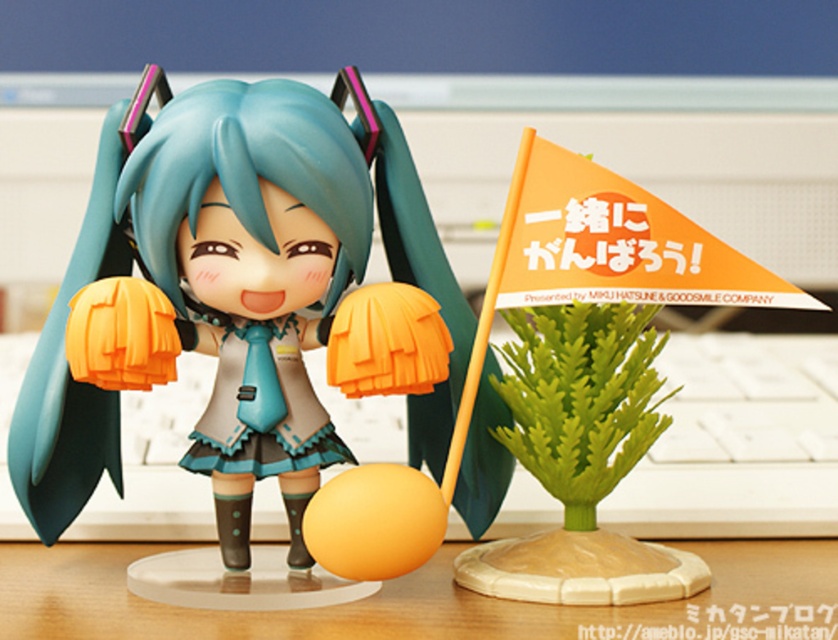
Between matte plastic doll at center and wooden table at center, which one is positioned lower?

wooden table at center

From the picture: Does matte plastic doll at center lie behind wooden table at center?

Yes, matte plastic doll at center is behind wooden table at center.

The height and width of the screenshot is (640, 838). I want to click on matte plastic doll at center, so click(x=242, y=300).